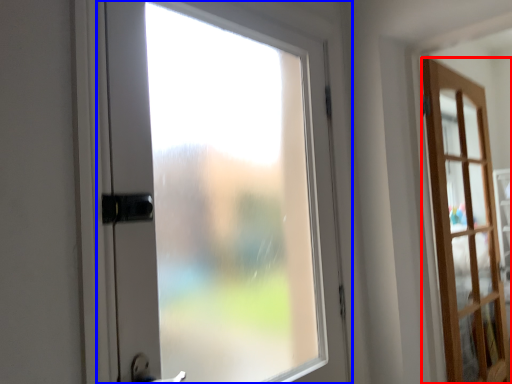
Question: Which object is further to the camera taking this photo, door (highlighted by a red box) or door (highlighted by a blue box)?

Choices:
 (A) door
 (B) door

Answer: (A)